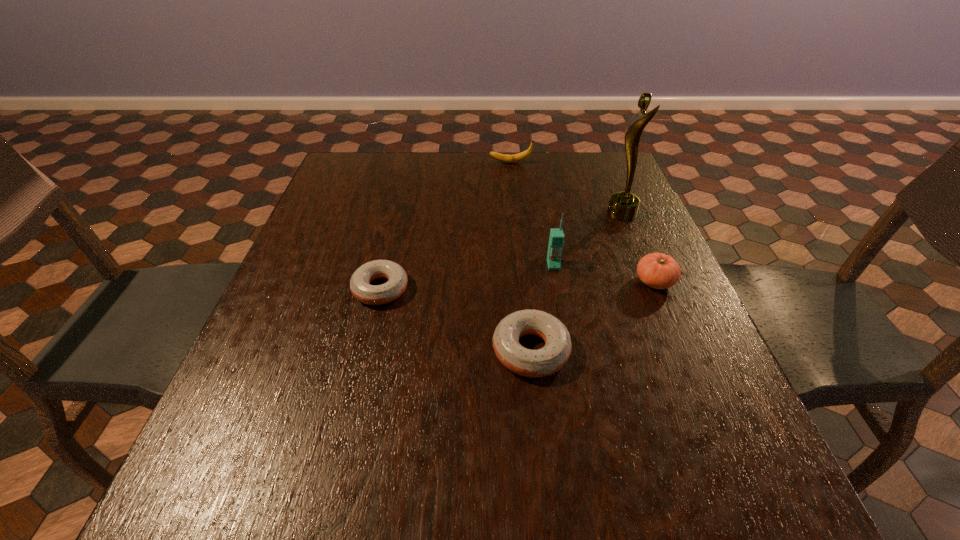
Identify the location of the shortest object. The image size is (960, 540). pyautogui.click(x=360, y=287).

What are the coordinates of `the leftmost object` in the screenshot? It's located at (360, 287).

The width and height of the screenshot is (960, 540). I want to click on the nearer doughnut, so click(549, 359).

This screenshot has height=540, width=960. What are the coordinates of `the right doughnut` in the screenshot? It's located at (549, 359).

You are a GUI agent. You are given a task and a screenshot of the screen. Output one action in this format:
    pyautogui.click(x=<x>, y=<y>)
    Task: Click on the banana
    Image resolution: width=960 pixels, height=540 pixels.
    Given the screenshot: What is the action you would take?
    pyautogui.click(x=515, y=158)

The image size is (960, 540). What are the coordinates of `tomato` in the screenshot? It's located at (657, 270).

Where is `the fifth shortest object`? the fifth shortest object is located at coordinates (556, 240).

Find the location of a particular element. The image size is (960, 540). award is located at coordinates (623, 206).

Find the location of a particular element. the second farthest object is located at coordinates (623, 206).

In order to click on vacant area located on the right of the leftmost object in this screenshot , I will do `click(544, 289)`.